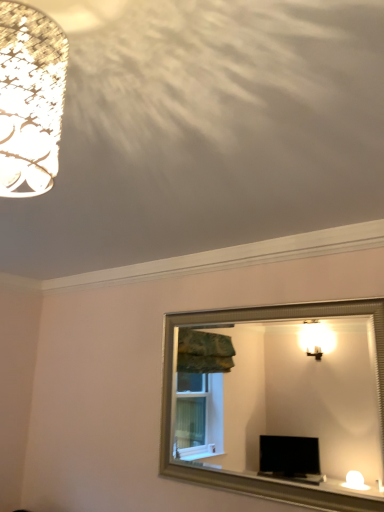
Question: Is matte white lampshade at upper left in front of or behind silver/metallic mirror at center in the image?

Choices:
 (A) behind
 (B) front

Answer: (B)

Question: Would you say matte white lampshade at upper left is inside or outside silver/metallic mirror at center?

Choices:
 (A) inside
 (B) outside

Answer: (B)

Question: In terms of height, does matte white lampshade at upper left look taller or shorter compared to silver/metallic mirror at center?

Choices:
 (A) short
 (B) tall

Answer: (A)

Question: Is point (292, 385) positioned closer to the camera than point (34, 26)?

Choices:
 (A) closer
 (B) farther

Answer: (B)

Question: Do you think silver/metallic mirror at center is within matte white lampshade at upper left, or outside of it?

Choices:
 (A) inside
 (B) outside

Answer: (B)

Question: From a real-world perspective, is silver/metallic mirror at center above or below matte white lampshade at upper left?

Choices:
 (A) above
 (B) below

Answer: (B)

Question: In terms of height, does silver/metallic mirror at center look taller or shorter compared to matte white lampshade at upper left?

Choices:
 (A) tall
 (B) short

Answer: (A)